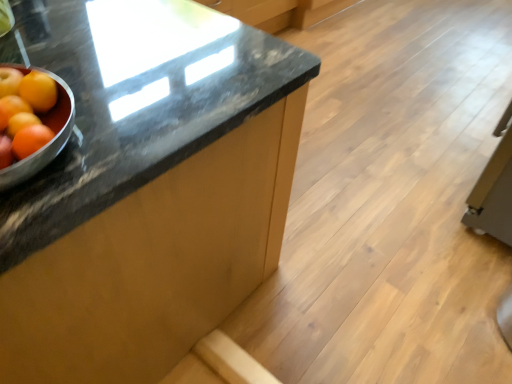
Identify the location of black granite countertop at center. (134, 95).

At what (x,y) coordinates should I click in order to perform the action: click on orange matte grapefruit at left. Please return your answer as a coordinate pair (x, y). Image resolution: width=512 pixels, height=384 pixels. Looking at the image, I should click on (24, 113).

Measure the distance between orange matte at left and camera.

56.25 centimeters.

You are a GUI agent. You are given a task and a screenshot of the screen. Output one action in this format:
    pyautogui.click(x=<x>, y=<y>)
    Task: Click on the orange matte at left
    This screenshot has width=512, height=384.
    Given the screenshot: What is the action you would take?
    pyautogui.click(x=11, y=109)

Where is `orange matte at left`? Image resolution: width=512 pixels, height=384 pixels. orange matte at left is located at coordinates (38, 91).

At what (x,y) coordinates should I click in order to perform the action: click on black granite countertop at center. Please return your answer as a coordinate pair (x, y). Looking at the image, I should click on (134, 95).

In terms of height, does orange matte at left look taller or shorter compared to orange matte at left?

Considering their sizes, orange matte at left has less height than orange matte at left.

Which of these two, orange matte at left or orange matte at left, is smaller?

With smaller size is orange matte at left.

From the image's perspective, is orange matte at left under orange matte at left?

Indeed, from the image's perspective, orange matte at left is shown beneath orange matte at left.

Who is taller, orange matte grapefruit at left or black granite countertop at center?

With more height is black granite countertop at center.

Is orange matte grapefruit at left facing away from black granite countertop at center?

No, orange matte grapefruit at left is not facing the opposite direction of black granite countertop at center.

I want to click on grapefruit below the black granite countertop at center (from the image's perspective), so click(24, 113).

Is black granite countertop at center outside of orange matte at left?

Yes, black granite countertop at center is not within orange matte at left.

Is orange matte at left at the back of black granite countertop at center?

No.

Which is more to the right, black granite countertop at center or orange matte at left?

orange matte at left is more to the right.

Is black granite countertop at center next to orange matte at left and touching it?

No, black granite countertop at center is not beside orange matte at left.

From the image's perspective, between orange matte at left and black granite countertop at center, who is located below?

black granite countertop at center.

Between orange matte at left and black granite countertop at center, which one appears on the right side from the viewer's perspective?

orange matte at left.

Who is taller, orange matte at left or black granite countertop at center?

Standing taller between the two is black granite countertop at center.

Which of these two, orange matte at left or black granite countertop at center, is bigger?

With larger size is black granite countertop at center.

Visually, is orange matte at left positioned to the left or to the right of black granite countertop at center?

From the image, it's evident that orange matte at left is to the right of black granite countertop at center.

Is the position of orange matte at left more distant than that of black granite countertop at center?

Yes, orange matte at left is further from the viewer.

Considering the sizes of objects orange matte at left and black granite countertop at center in the image provided, who is wider, orange matte at left or black granite countertop at center?

black granite countertop at center is wider.

Between orange matte at left and black granite countertop at center, which one has smaller size?

With smaller size is orange matte at left.

Is orange matte grapefruit at left next to orange matte at left and touching it?

→ Yes.

Is orange matte grapefruit at left turned away from orange matte at left?

No, orange matte grapefruit at left's orientation is not away from orange matte at left.

From their relative heights in the image, would you say orange matte grapefruit at left is taller or shorter than orange matte at left?

Clearly, orange matte grapefruit at left is shorter compared to orange matte at left.

Which object is more forward, orange matte grapefruit at left or orange matte at left?

orange matte grapefruit at left is in front.

From a real-world perspective, is black granite countertop at center located beneath orange matte grapefruit at left?

Yes, from a real-world perspective, black granite countertop at center is below orange matte grapefruit at left.

Can you confirm if black granite countertop at center is smaller than orange matte grapefruit at left?

Incorrect, black granite countertop at center is not smaller in size than orange matte grapefruit at left.

From the image's perspective, which object appears higher, black granite countertop at center or orange matte grapefruit at left?

black granite countertop at center is shown above in the image.

Is black granite countertop at center facing away from orange matte grapefruit at left?

No, black granite countertop at center is not facing away from orange matte grapefruit at left.

Locate an element on the screen. tangerine above the orange matte at left (from the image's perspective) is located at coordinates (38, 91).

Locate an element on the screen. countertop on the left of orange matte grapefruit at left is located at coordinates tap(134, 95).

From the image, which object appears to be farther from orange matte at left, black granite countertop at center or orange matte grapefruit at left?

black granite countertop at center lies further to orange matte at left than the other object.

Looking at the image, which one is located further to orange matte at left, black granite countertop at center or orange matte grapefruit at left?

black granite countertop at center is further to orange matte at left.

Considering their positions, is orange matte at left positioned closer to black granite countertop at center than orange matte grapefruit at left?

Among the two, orange matte grapefruit at left is located nearer to black granite countertop at center.

When comparing their distances from black granite countertop at center, does orange matte at left or orange matte at left seem closer?

The object closer to black granite countertop at center is orange matte at left.

Considering their positions, is black granite countertop at center positioned closer to orange matte grapefruit at left than orange matte at left?

orange matte at left.

Considering their positions, is orange matte at left positioned further to orange matte at left than orange matte grapefruit at left?

orange matte at left.

Estimate the real-world distances between objects in this image. Which object is closer to orange matte grapefruit at left, orange matte at left or orange matte at left?

Among the two, orange matte at left is located nearer to orange matte grapefruit at left.

Looking at the image, which one is located further to orange matte at left, orange matte at left or orange matte grapefruit at left?

The object further to orange matte at left is orange matte at left.

Where is `tangerine between black granite countertop at center and orange matte grapefruit at left from left to right`? This screenshot has width=512, height=384. tangerine between black granite countertop at center and orange matte grapefruit at left from left to right is located at coordinates (38, 91).

Locate an element on the screen. orange between orange matte at left and orange matte grapefruit at left in the vertical direction is located at coordinates (11, 109).

Find the location of `orange between black granite countertop at center and orange matte grapefruit at left in the horizontal direction`. orange between black granite countertop at center and orange matte grapefruit at left in the horizontal direction is located at coordinates (11, 109).

Find the location of `orange between black granite countertop at center and orange matte at left in the front-back direction`. orange between black granite countertop at center and orange matte at left in the front-back direction is located at coordinates (11, 109).